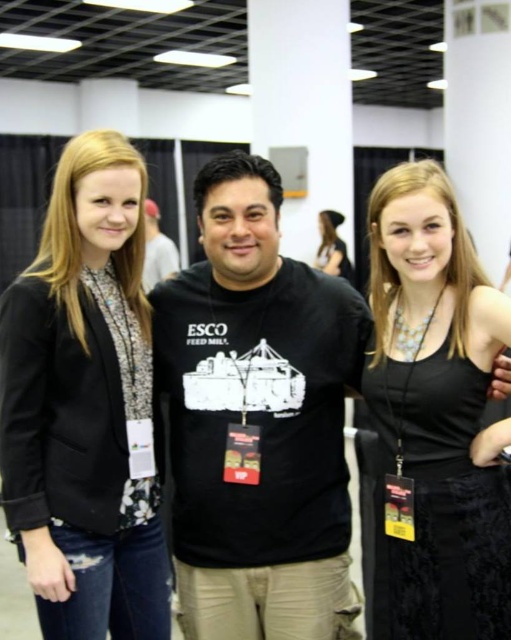
You are standing in the convention hall and see the black matte blazer at left and the black matte shirt at center. Which one is nearer to you?

The black matte blazer at left is closer to the viewer than the black matte shirt at center.

Based on the photo, you are standing in the convention hall and want to determine the relative positions of two points marked in the image. Which point is nearer to you, point at coordinates [36,344] or point at coordinates [160,257]?

Point at coordinates [36,344] is closer to the viewer than point at coordinates [160,257].